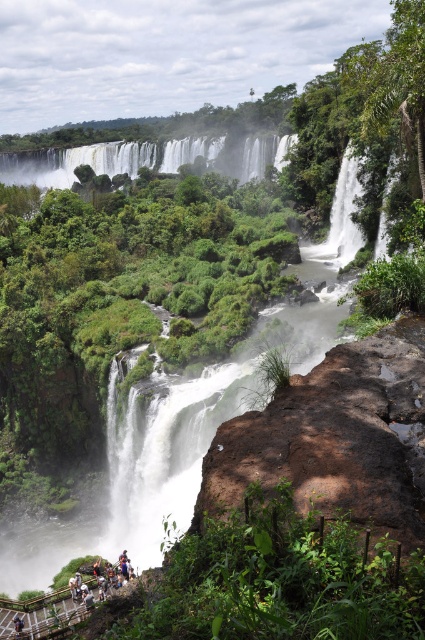
You are standing on the wooden walkway at the bottom left corner of the waterfall scene. You notice the white frothy water at center and the dark blue jeans at lower left. Which object is higher in elevation?

The white frothy water at center is taller than the dark blue jeans at lower left, so the white frothy water at center is higher in elevation.

You are standing at the bottom left corner of the image where the wooden walkway is located. You want to take a photo of the white frothy water at center. Based on its 2D location, in which direction should you point your camera to capture it?

The white frothy water at center is located at point (147, 157) in 2D coordinates. Since you are at the bottom left corner, pointing the camera towards the center area would capture it.